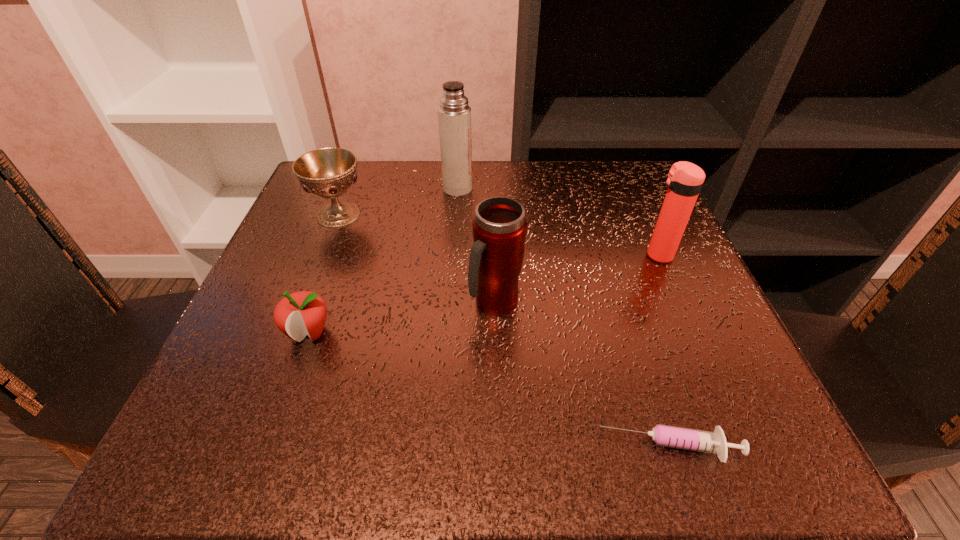
Choose which thermos bottle is the third nearest neighbor to the shortest object. Please provide its 2D coordinates. Your answer should be formatted as a tuple, i.e. [(x, y)], where the tuple contains the x and y coordinates of a point satisfying the conditions above.

[(454, 114)]

Image resolution: width=960 pixels, height=540 pixels. I want to click on free location that satisfies the following two spatial constraints: 1. on the front side of the fourth tallest object; 2. on the left side of the apple, so [293, 333].

The width and height of the screenshot is (960, 540). Find the location of `free space that satisfies the following two spatial constraints: 1. on the side with the handle of the nearest thermos bottle; 2. on the left side of the shortest object`. free space that satisfies the following two spatial constraints: 1. on the side with the handle of the nearest thermos bottle; 2. on the left side of the shortest object is located at coordinates (499, 449).

This screenshot has height=540, width=960. Find the location of `blank area in the image that satisfies the following two spatial constraints: 1. on the front side of the shortest object; 2. on the right side of the farthest thermos bottle`. blank area in the image that satisfies the following two spatial constraints: 1. on the front side of the shortest object; 2. on the right side of the farthest thermos bottle is located at coordinates [x=441, y=449].

Where is `vacant space that satisfies the following two spatial constraints: 1. on the front side of the shortest object; 2. on the left side of the second shortest object`? The width and height of the screenshot is (960, 540). vacant space that satisfies the following two spatial constraints: 1. on the front side of the shortest object; 2. on the left side of the second shortest object is located at coordinates (268, 449).

I want to click on vacant space that satisfies the following two spatial constraints: 1. on the side with the handle of the shortest object; 2. on the right side of the nearest thermos bottle, so pyautogui.click(x=499, y=449).

The height and width of the screenshot is (540, 960). I want to click on vacant space that satisfies the following two spatial constraints: 1. on the back side of the farthest object; 2. on the right side of the second shortest object, so click(x=360, y=188).